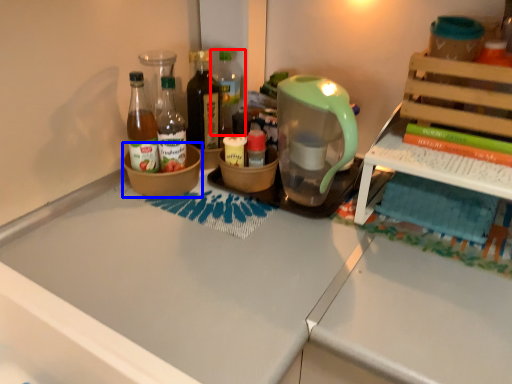
Question: Which of the following is the closest to the observer, bottle (highlighted by a red box) or bowl (highlighted by a blue box)?

Choices:
 (A) bottle
 (B) bowl

Answer: (B)